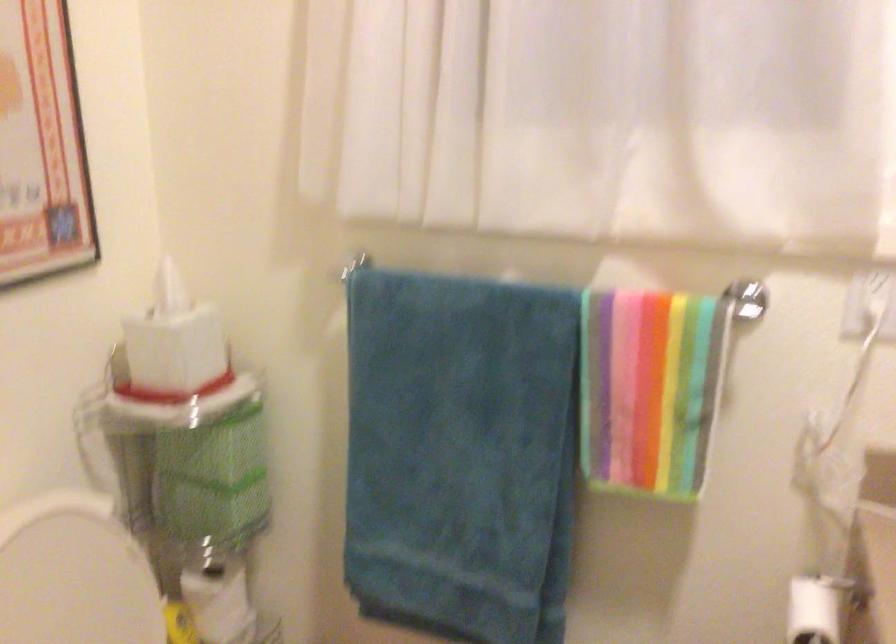
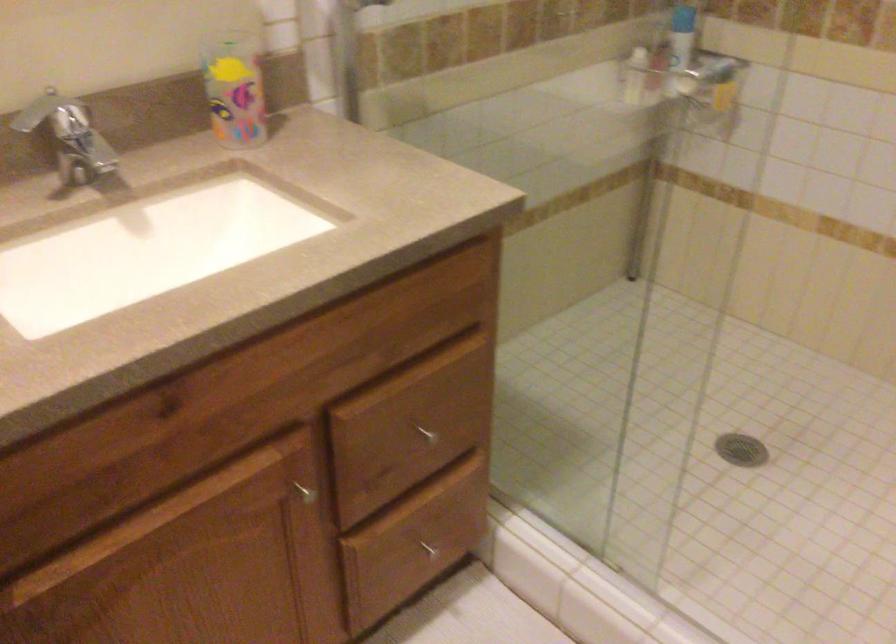
First-person continuous shooting, in which direction is the camera rotating?

The camera rotated toward right-down.